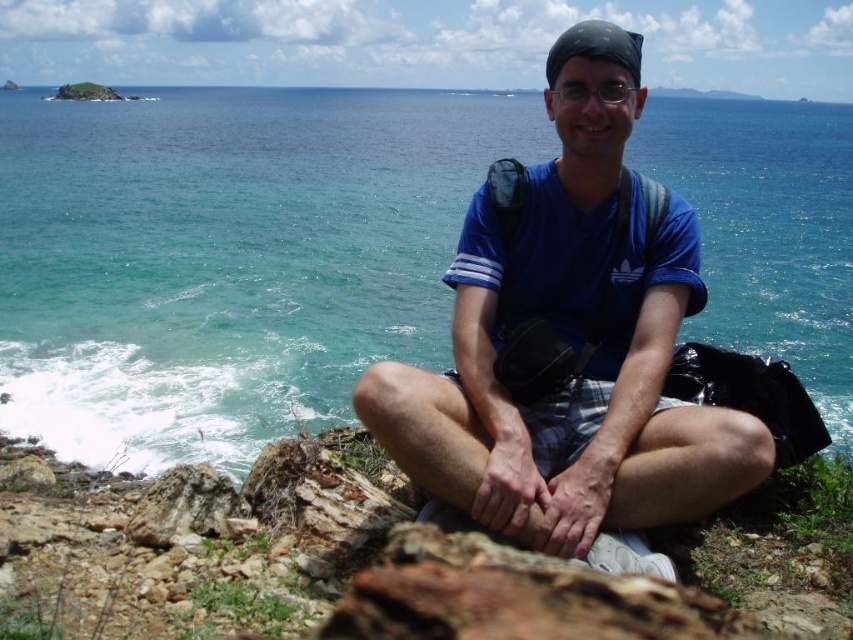
Question: Which point is farther to the camera?

Choices:
 (A) (108, 134)
 (B) (512, 461)

Answer: (A)

Question: Which point is farther from the camera taking this photo?

Choices:
 (A) (111, 413)
 (B) (582, 212)

Answer: (A)

Question: Is blue water at center to the left of blue cotton shirt at center from the viewer's perspective?

Choices:
 (A) yes
 (B) no

Answer: (A)

Question: Can you confirm if blue water at center is positioned above blue cotton shirt at center?

Choices:
 (A) no
 (B) yes

Answer: (B)

Question: Does blue water at center lie behind blue cotton shirt at center?

Choices:
 (A) yes
 (B) no

Answer: (A)